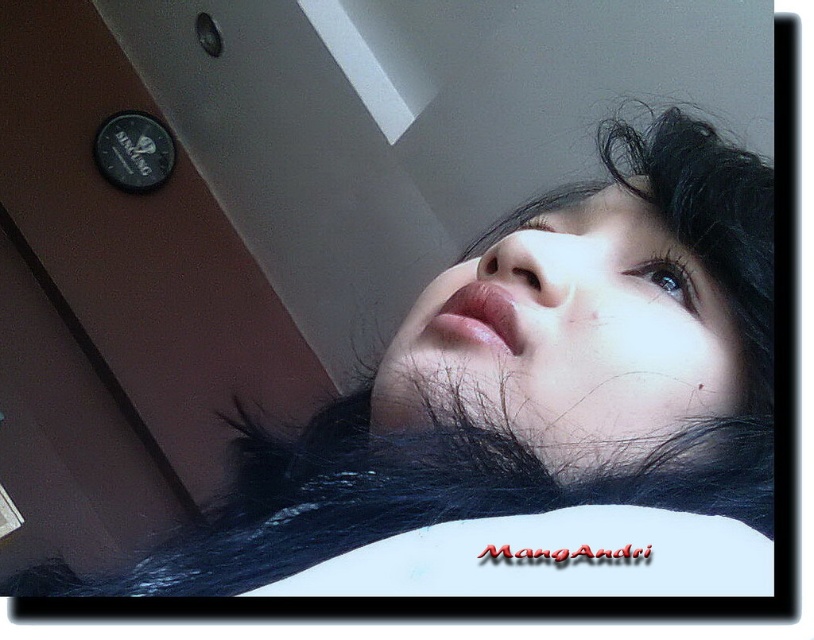
Can you confirm if smooth skin face at upper center is smaller than black glossy eye at upper center?

No, smooth skin face at upper center is not smaller than black glossy eye at upper center.

Consider the image. Between smooth skin face at upper center and black glossy eye at upper center, which one is positioned higher?

black glossy eye at upper center is above.

Does point (484, 404) come in front of point (690, 278)?

Yes, point (484, 404) is closer to viewer.

Find the location of a particular element. smooth skin face at upper center is located at coordinates (532, 412).

Is black glossy eye at upper center thinner than matte black eye at upper center?

Incorrect, black glossy eye at upper center's width is not less than matte black eye at upper center's.

This screenshot has height=640, width=814. In order to click on black glossy eye at upper center in this screenshot , I will do `click(668, 280)`.

Who is more forward, [697,294] or [532,224]?

Positioned in front is point [697,294].

Locate an element on the screen. black glossy eye at upper center is located at coordinates (668, 280).

Where is `smooth skin face at upper center`? Image resolution: width=814 pixels, height=640 pixels. smooth skin face at upper center is located at coordinates (532, 412).

I want to click on smooth skin face at upper center, so click(532, 412).